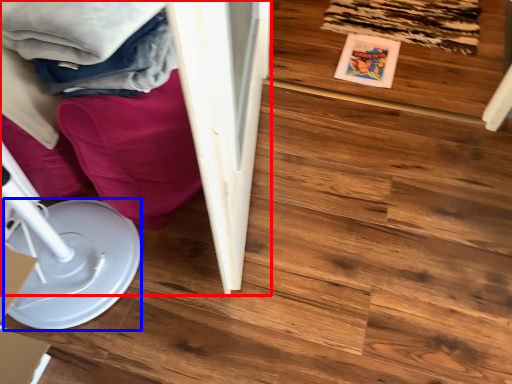
Question: Which point is further to the camera, furniture (highlighted by a red box) or paper plate (highlighted by a blue box)?

Choices:
 (A) furniture
 (B) paper plate

Answer: (A)